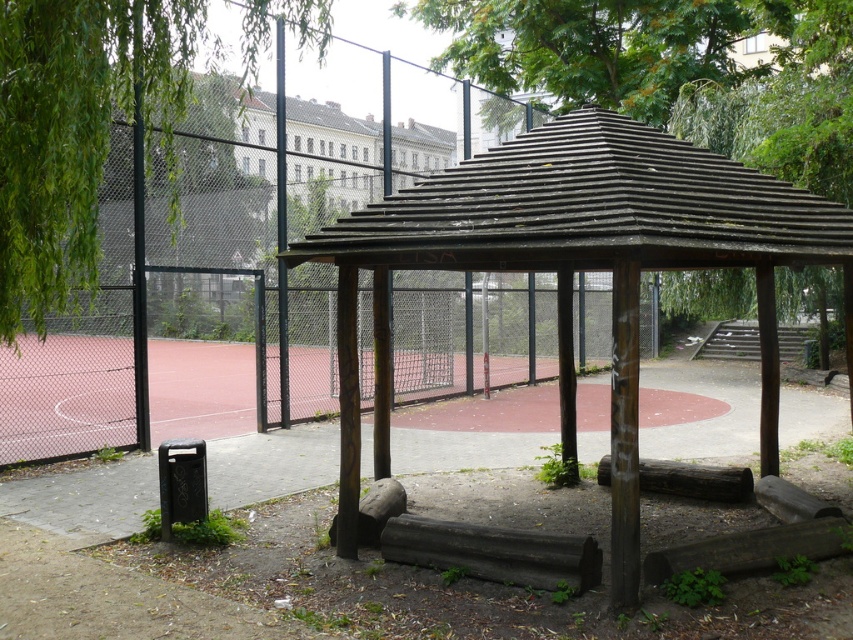
You are planning to set up a picnic blanket between the weathered wood gazebo at center and the green leafy tree at left. Which object should you place the blanket closer to if you want it to be under the shade of the tree?

You should place the picnic blanket closer to the green leafy tree at left to ensure it is under the shade since the weathered wood gazebo at center is positioned on the right side of the green leafy tree at left, meaning the tree is to the left of the gazebo. Therefore, positioning the blanket near the tree would place it under its shade.

You are standing at the camera position and want to walk to the point marked at coordinates (695, 205). How far will you have to walk?

The point marked at coordinates (695, 205) is 5.50 meters away from the camera, so you will have to walk 5.50 meters to reach it.

You are standing at the point marked as point (576, 259) in the image. What structure are you facing directly?

The point (576, 259) indicates the weathered wood gazebo at center, so you are facing the weathered wood gazebo at center directly.